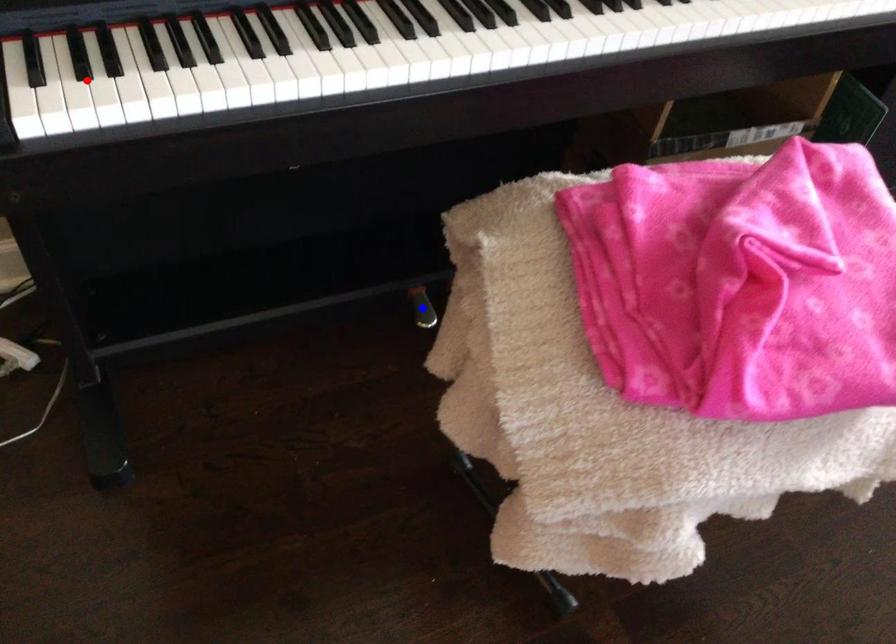
Question: Two points are marked on the image. Which point is closer to the camera?

Choices:
 (A) Blue point is closer.
 (B) Red point is closer.

Answer: (B)